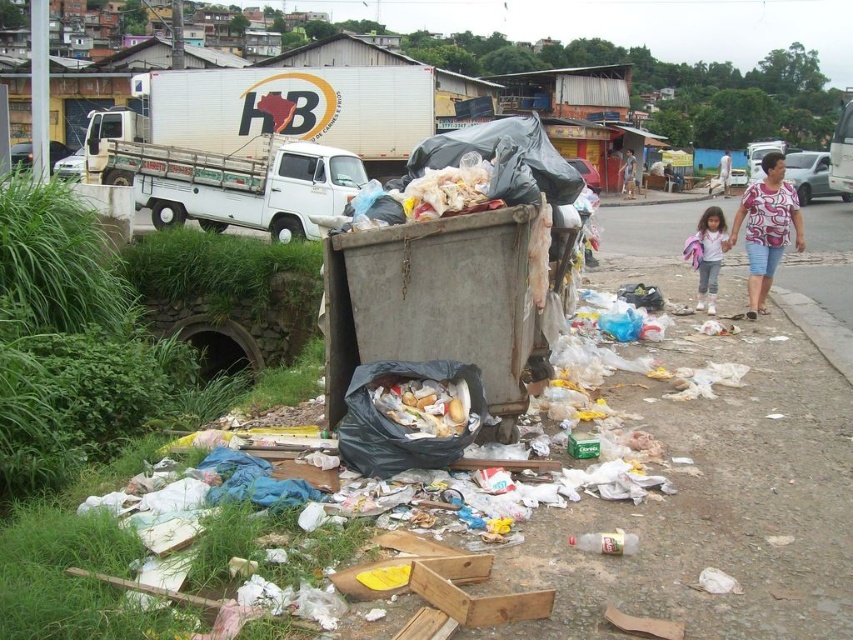
You are standing in front of the dumpster and want to take a photo of the scene. You notice two points marked in the image. Which point, point (x=786, y=611) or point (x=721, y=173), will appear larger in your photo?

Point (x=786, y=611) will appear larger in the photo because it is closer to the camera than point (x=721, y=173).

You are a delivery person who needs to park your vehicle near the white matte truck at left and the light brown fabric dress at lower right. Which object is closer to the parking spot where you should position your vehicle?

The white matte truck at left is closer to the parking spot because it is positioned to the left of the light brown fabric dress at lower right, meaning it is nearer to the area where vehicles are typically parked.

You are standing at the point with coordinates point (627, 164) and want to walk to the point (216, 227). Based on the scene description, which direction should you move in relation to the dumpster?

You should move forward towards the dumpster because point (216, 227) is in front of point (627, 164).